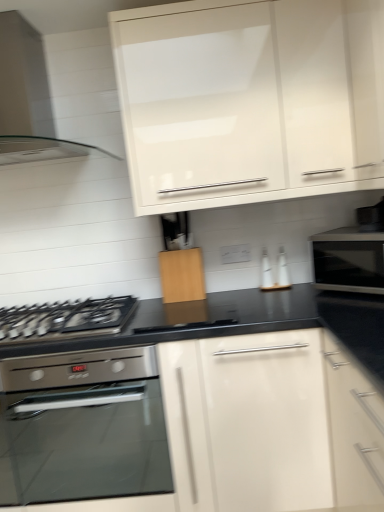
Question: From their relative heights in the image, would you say clear glass range hood at upper left is taller or shorter than wooden cutting board at center, which ranks as the 2th cabinetry in top-to-bottom order?

Choices:
 (A) tall
 (B) short

Answer: (A)

Question: In the image, is clear glass range hood at upper left positioned in front of or behind wooden cutting board at center, which is the 1th cabinetry in bottom-to-top order?

Choices:
 (A) front
 (B) behind

Answer: (A)

Question: Which object is positioned closest to the clear glass range hood at upper left?

Choices:
 (A) black glossy microwave at right
 (B) white glossy cabinet at upper center, which is the second cabinetry from bottom to top
 (C) wooden cutting board at center, which is the 1th cabinetry in bottom-to-top order
 (D) black matte gas stove at lower left
 (E) stainless steel oven at lower left

Answer: (B)

Question: Which object is positioned closest to the wooden cutting board at center, which ranks as the 2th cabinetry in top-to-bottom order?

Choices:
 (A) clear glass range hood at upper left
 (B) stainless steel oven at lower left
 (C) black glossy microwave at right
 (D) black matte gas stove at lower left
 (E) white glossy cabinet at upper center, arranged as the first cabinetry when viewed from the top

Answer: (D)